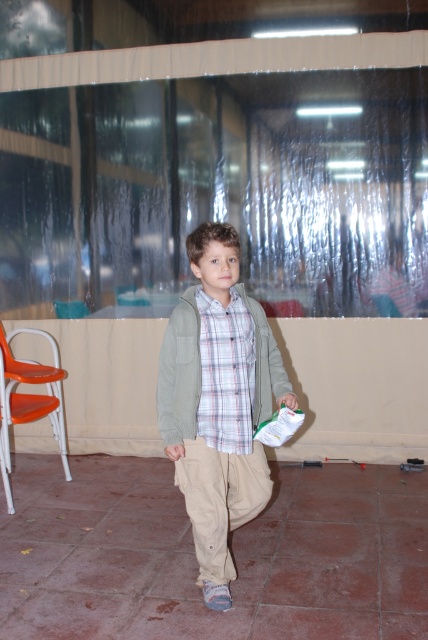
Question: Is khaki cotton pants at center closer to camera compared to orange plastic chair at lower left?

Choices:
 (A) no
 (B) yes

Answer: (B)

Question: Which of the following is the closest to the observer?

Choices:
 (A) plaid fabric shirt at center
 (B) light brown cotton pants at center

Answer: (B)

Question: Can you confirm if khaki cotton pants at center is positioned above smooth beige hand at center?

Choices:
 (A) no
 (B) yes

Answer: (A)

Question: Can you confirm if light brown cotton pants at center is positioned above khaki cotton pants at center?

Choices:
 (A) no
 (B) yes

Answer: (B)

Question: Among these points, which one is nearest to the camera?

Choices:
 (A) (240, 333)
 (B) (252, 449)
 (C) (222, 604)
 (D) (23, 404)

Answer: (A)

Question: Which point is closer to the camera?

Choices:
 (A) (237, 241)
 (B) (29, 396)

Answer: (A)